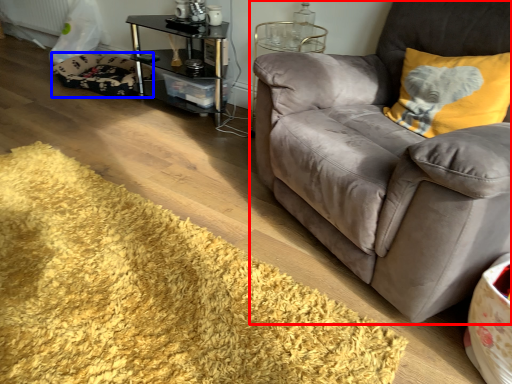
Question: Among these objects, which one is farthest to the camera, studio couch (highlighted by a red box) or dog bed (highlighted by a blue box)?

Choices:
 (A) studio couch
 (B) dog bed

Answer: (B)